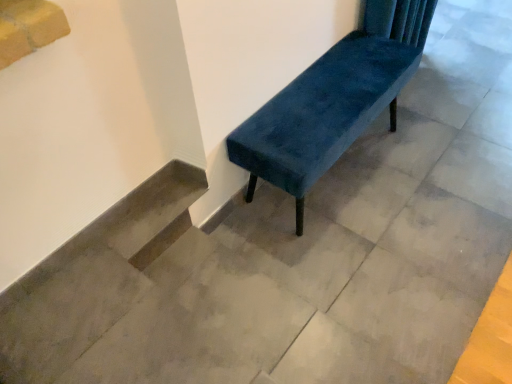
Question: Should I look upward or downward to see velvet blue bench at center?

Choices:
 (A) down
 (B) up

Answer: (B)